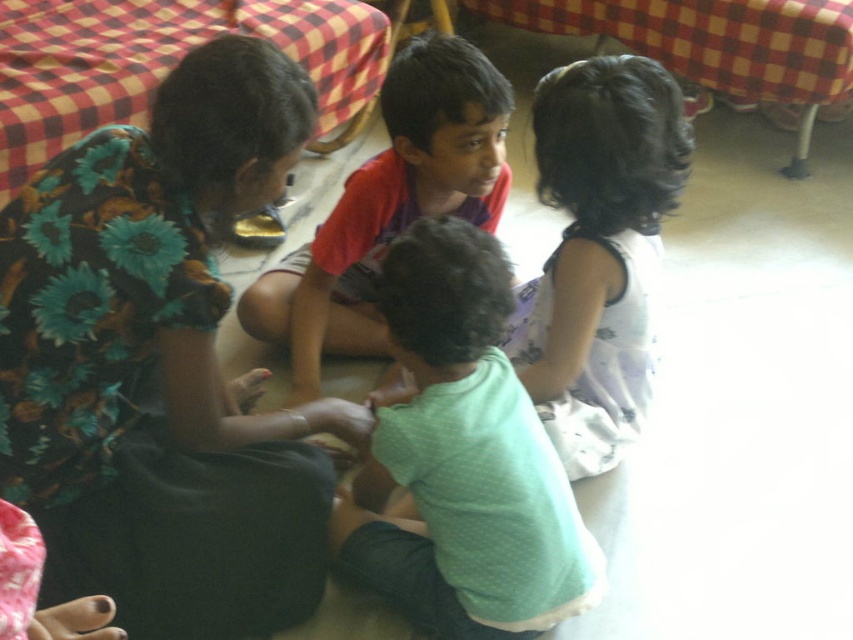
Is green dotted shirt at center positioned at the back of red shirt at center?

No.

Is green dotted shirt at center thinner than red shirt at center?

Yes, green dotted shirt at center is thinner than red shirt at center.

Is point (419, 346) farther from viewer compared to point (451, 141)?

No, (419, 346) is closer to viewer.

What are the coordinates of `green dotted shirt at center` in the screenshot? It's located at (462, 460).

Does floral fabric dress at upper left appear over white floral dress at upper right?

Actually, floral fabric dress at upper left is below white floral dress at upper right.

Between floral fabric dress at upper left and white floral dress at upper right, which one appears on the left side from the viewer's perspective?

floral fabric dress at upper left is more to the left.

Is point (193, 544) closer to viewer compared to point (563, 268)?

That is True.

The height and width of the screenshot is (640, 853). I want to click on floral fabric dress at upper left, so click(161, 364).

Between floral fabric dress at upper left and green dotted shirt at center, which one is positioned lower?

green dotted shirt at center is below.

From the picture: Does floral fabric dress at upper left appear on the left side of green dotted shirt at center?

Correct, you'll find floral fabric dress at upper left to the left of green dotted shirt at center.

The image size is (853, 640). What do you see at coordinates (161, 364) in the screenshot?
I see `floral fabric dress at upper left` at bounding box center [161, 364].

Where is `floral fabric dress at upper left`? This screenshot has width=853, height=640. floral fabric dress at upper left is located at coordinates (161, 364).